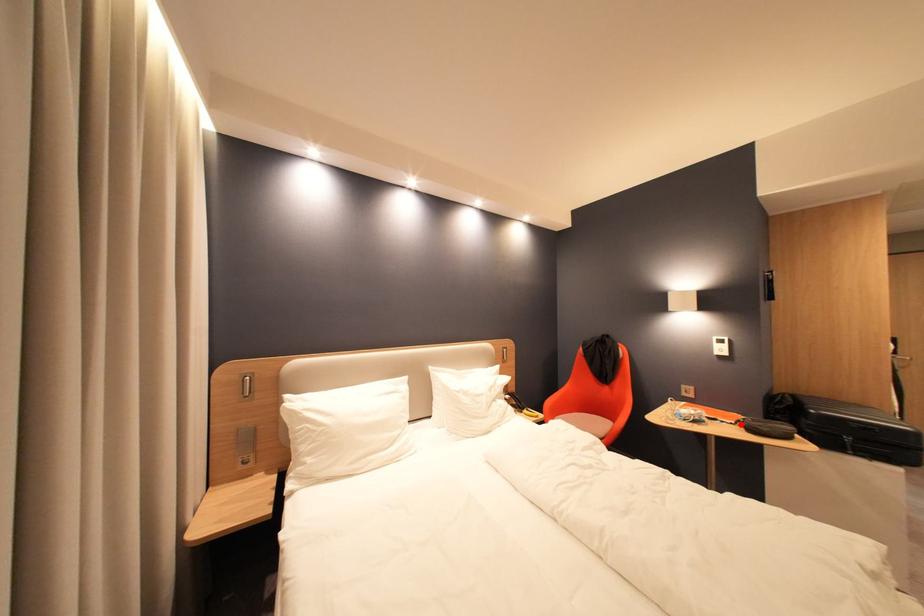
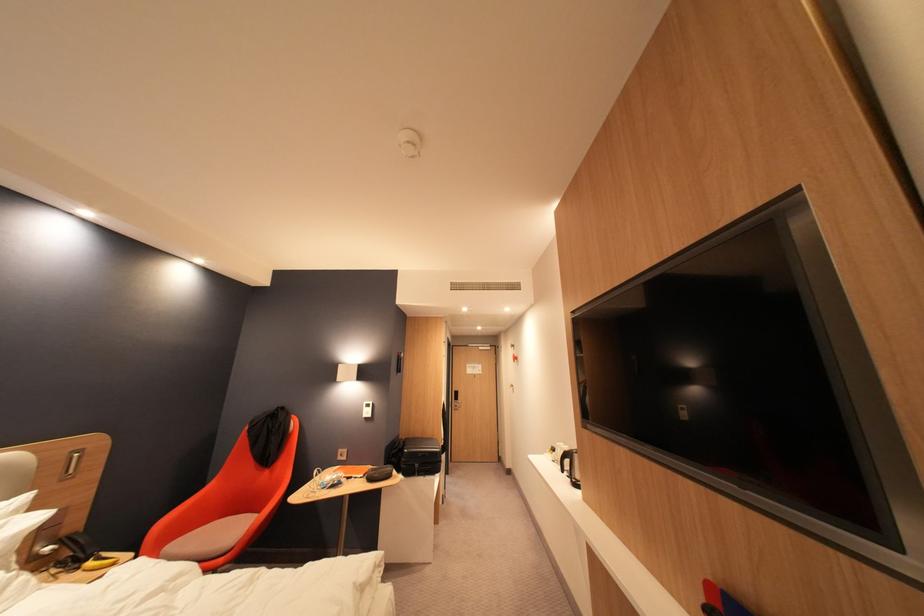
Where in the second image is the point corresponding to the highlighted location from the first image?

(371, 477)